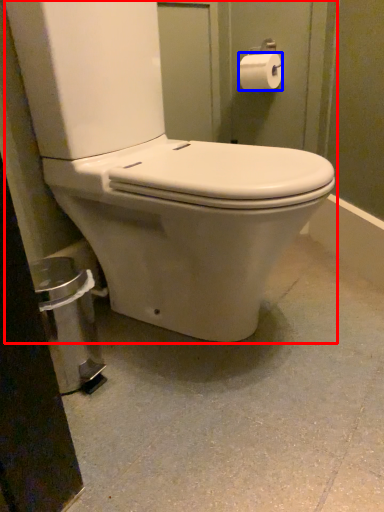
Question: Among these objects, which one is farthest to the camera, toilet (highlighted by a red box) or toilet paper (highlighted by a blue box)?

Choices:
 (A) toilet
 (B) toilet paper

Answer: (B)